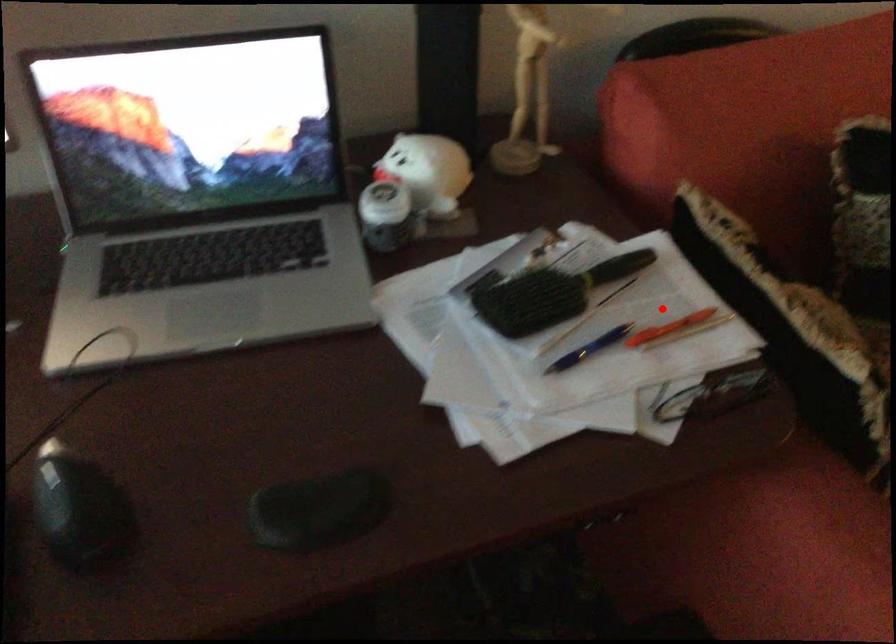
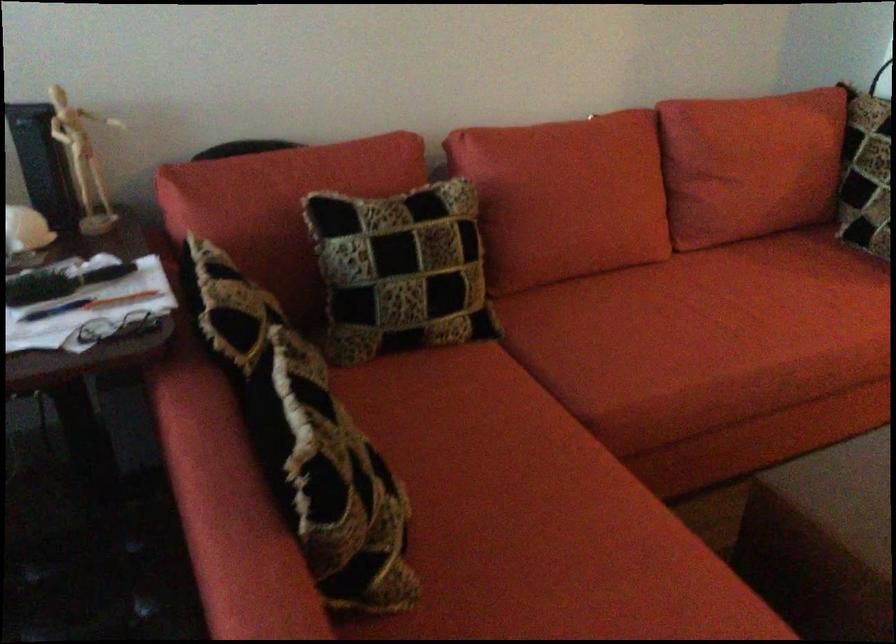
Question: A red point is marked in image1. In image2, is the corresponding 3D point closer to the camera or farther? Reply with the corresponding letter.

Choices:
 (A) The corresponding 3D point is closer.
 (B) The corresponding 3D point is farther.

Answer: (B)